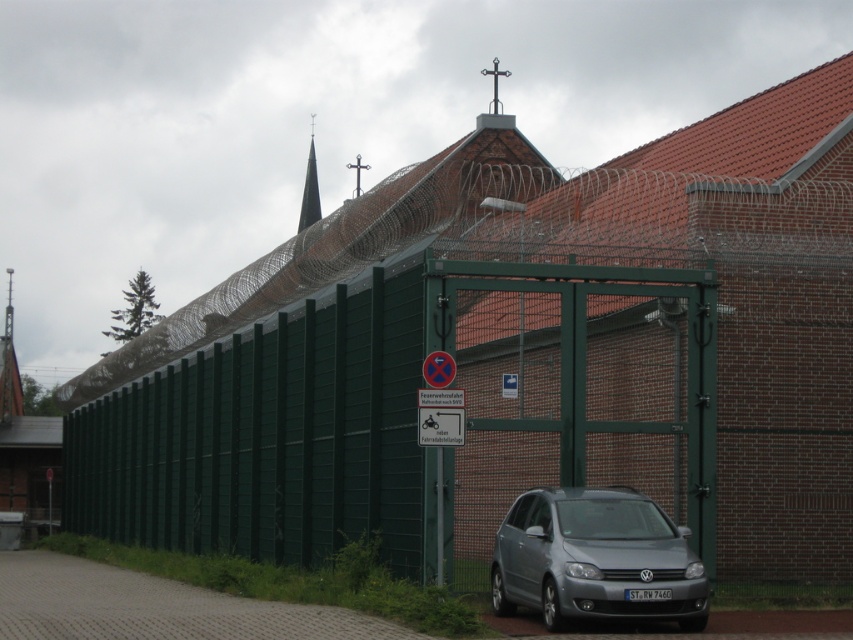
Question: Does satin silver car at lower center appear under smooth gray steeple at upper center?

Choices:
 (A) no
 (B) yes

Answer: (B)

Question: Which point is farther from the camera taking this photo?

Choices:
 (A) (300, 211)
 (B) (668, 554)

Answer: (A)

Question: Is satin silver car at lower center bigger than smooth gray steeple at upper center?

Choices:
 (A) no
 (B) yes

Answer: (A)

Question: Which of the following is the closest to the observer?

Choices:
 (A) smooth gray steeple at upper center
 (B) satin silver car at lower center

Answer: (B)

Question: Which of the following is the farthest from the observer?

Choices:
 (A) (532, 536)
 (B) (312, 125)

Answer: (B)

Question: Is satin silver car at lower center closer to the viewer compared to smooth gray steeple at upper center?

Choices:
 (A) yes
 (B) no

Answer: (A)